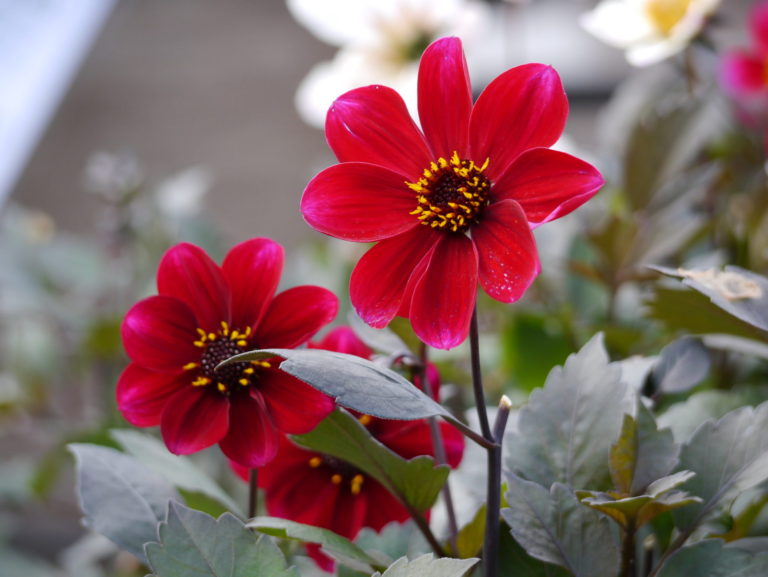
I want to click on right corner pink flower, so click(743, 73).